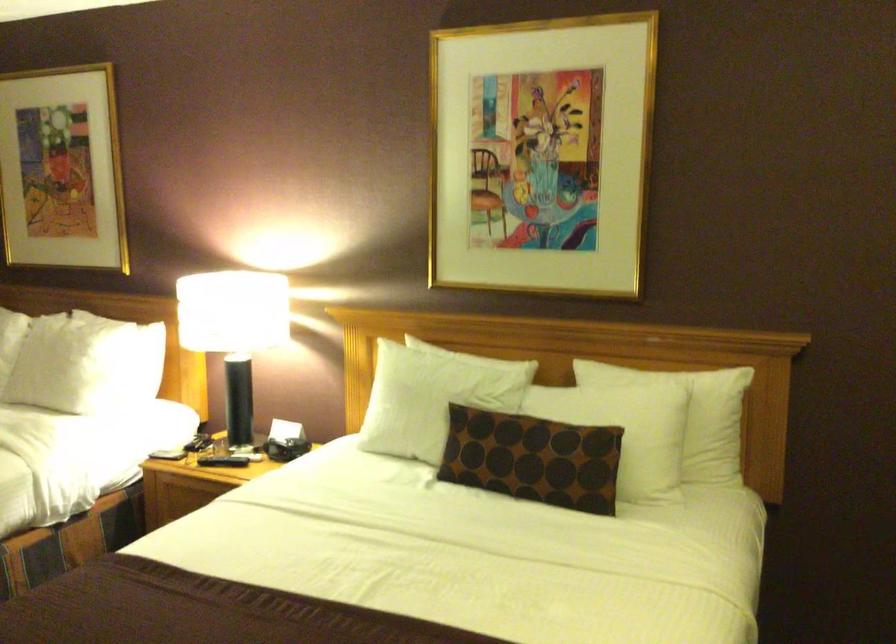
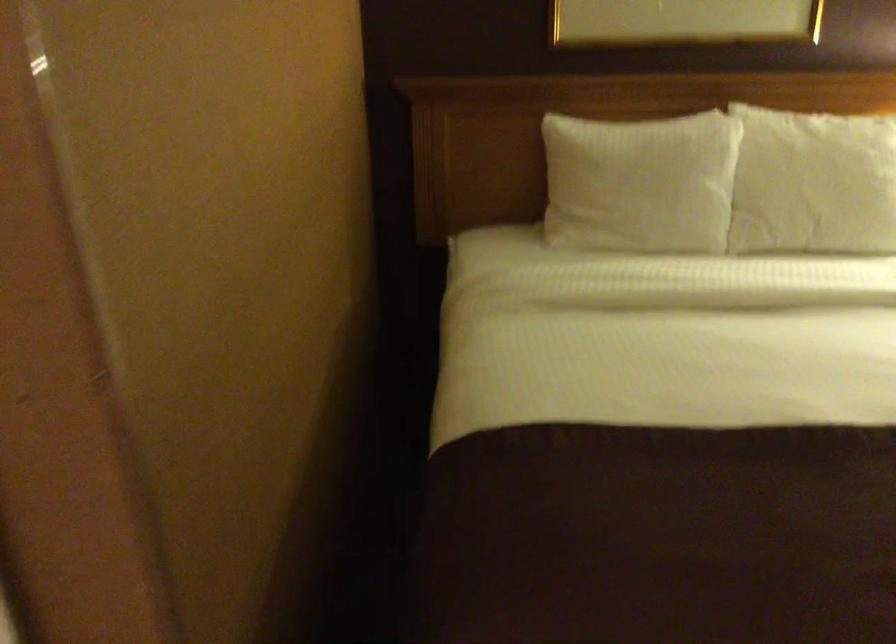
What movement of the cameraman would produce the second image?

The cameraman moved toward left, forward.